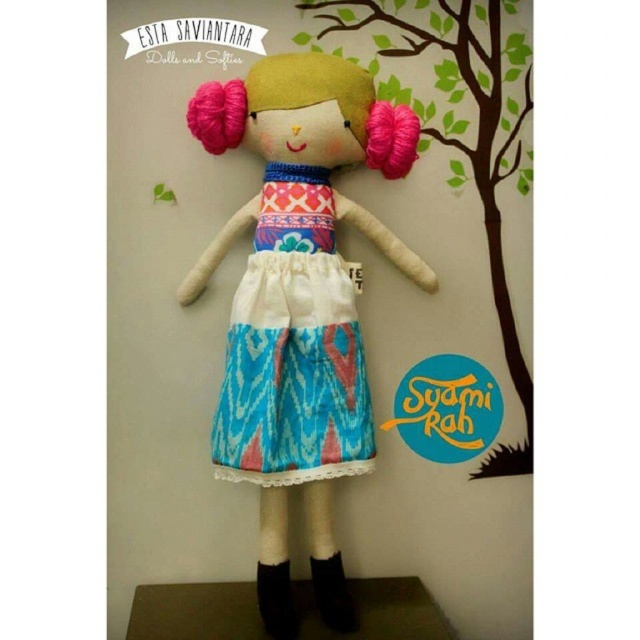
You are an interior designer arranging a nursery. You have a textured fabric doll at center and a blue ikat apron at center. Which object is more to the left?

The blue ikat apron at center is more to the left because the textured fabric doll at center is positioned on the right side of it.

You are a tailor who needs to adjust the blue ikat apron at center so that it is 1.5 inches away from the textured fabric doll at center. Can you do this adjustment without moving the doll?

The textured fabric doll at center is currently 1.11 inches from the blue ikat apron at center. To achieve the desired 1.5 inches distance, you can move the blue ikat apron away from the doll by 0.39 inches.

You are taking a photo of the handmade doll and notice two points on its body labeled as point (275, 337) and point (237, 416). Which point is closer to the camera?

Point (275, 337) is further to the camera than point (237, 416).